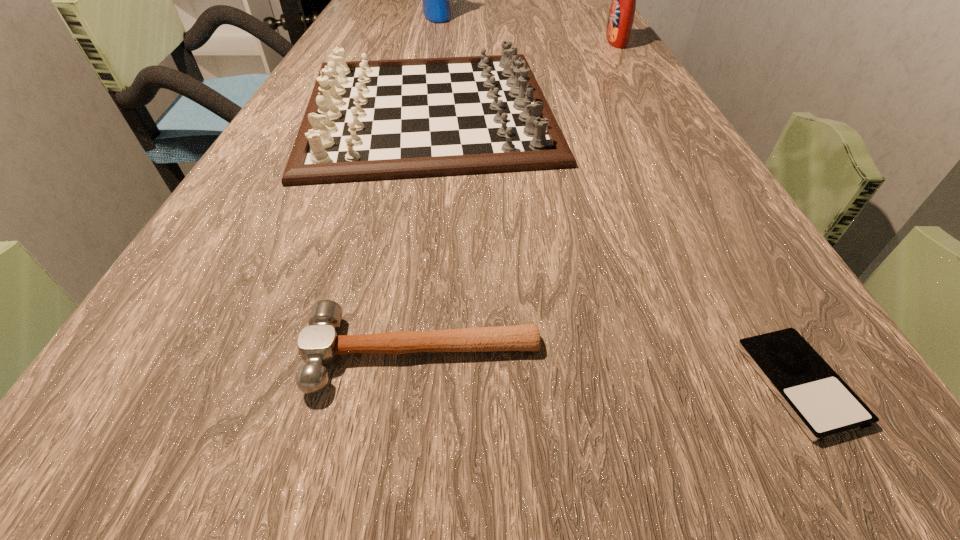
Identify the location of the taller detergent. The height and width of the screenshot is (540, 960). (436, 6).

The width and height of the screenshot is (960, 540). I want to click on the farthest object, so click(436, 6).

This screenshot has width=960, height=540. Identify the location of the shorter detergent. (621, 16).

Locate an element on the screen. The height and width of the screenshot is (540, 960). the right detergent is located at coordinates 621,16.

Locate an element on the screen. The height and width of the screenshot is (540, 960). chessboard is located at coordinates (374, 120).

Identify the location of the third farthest object. This screenshot has height=540, width=960. (374, 120).

In order to click on the fourth tallest object in this screenshot , I will do click(x=319, y=344).

I want to click on the shortest object, so click(823, 405).

Where is `vacant region located 0.350m on the label of the farther detergent`? This screenshot has width=960, height=540. vacant region located 0.350m on the label of the farther detergent is located at coordinates (572, 16).

Where is `free spot located 0.200m on the front surface of the second farthest object`? free spot located 0.200m on the front surface of the second farthest object is located at coordinates (528, 41).